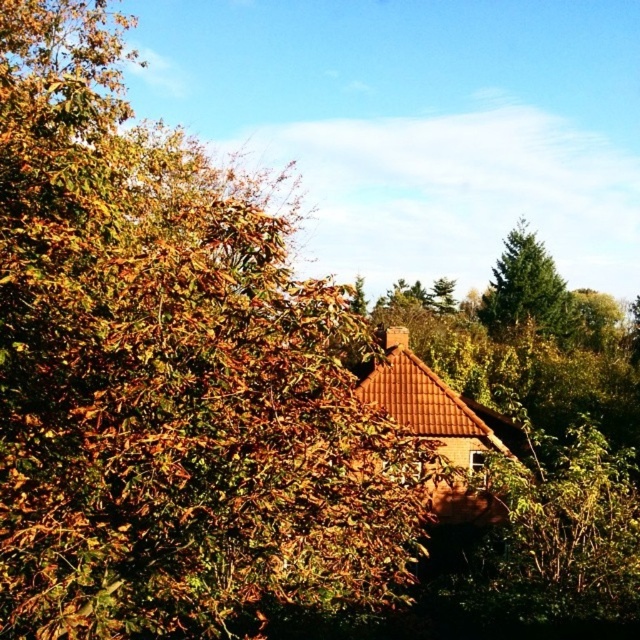
Based on the photo, who is shorter, brown leafy tree at center or green fir tree at upper right?

green fir tree at upper right

Between brown leafy tree at center and green fir tree at upper right, which one is positioned higher?

Positioned higher is brown leafy tree at center.

The image size is (640, 640). Describe the element at coordinates (168, 378) in the screenshot. I see `brown leafy tree at center` at that location.

The image size is (640, 640). I want to click on brown leafy tree at center, so click(x=168, y=378).